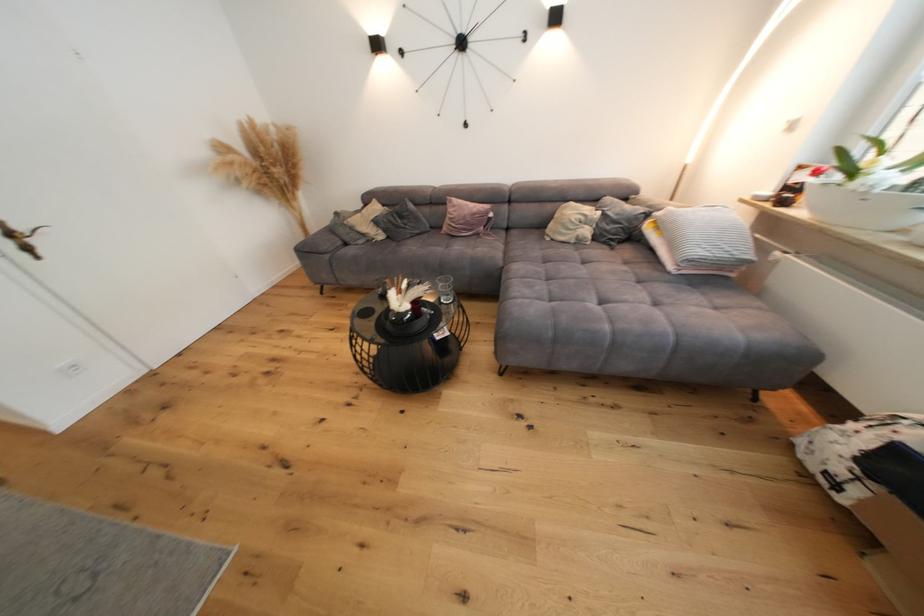
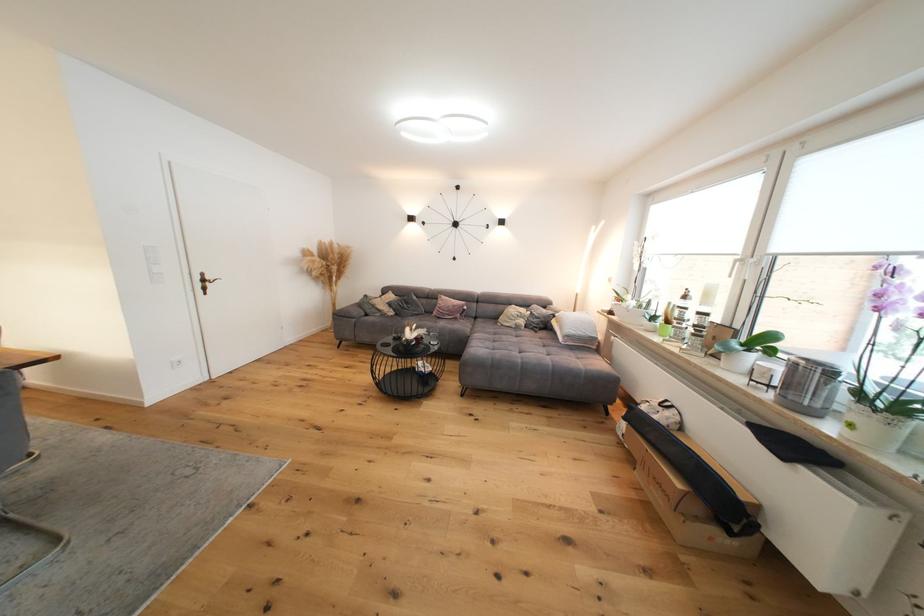
Locate, in the second image, the point that corresponds to (x=455, y=222) in the first image.

(444, 310)